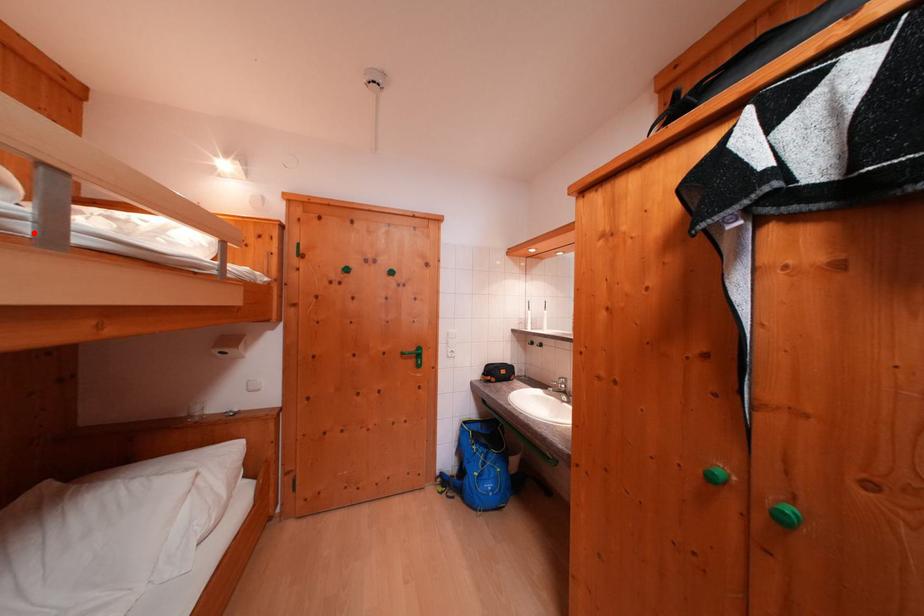
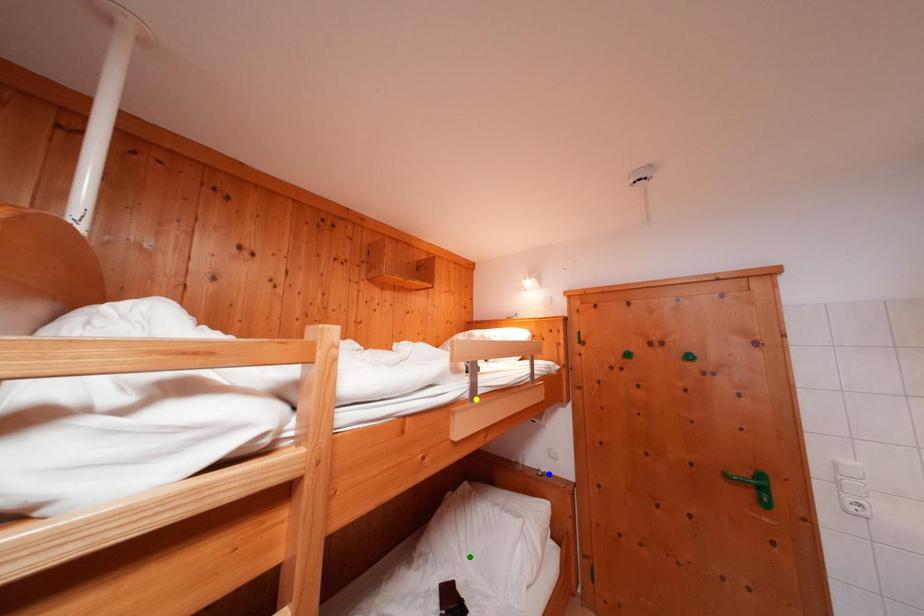
Question: I am providing you with two images of the same scene from different viewpoints. A red point is marked on the first image. You are given multiple points on the second image. Can you choose the point in image 2 that corresponds to the point in image 1?

Choices:
 (A) blue point
 (B) yellow point
 (C) green point

Answer: (B)